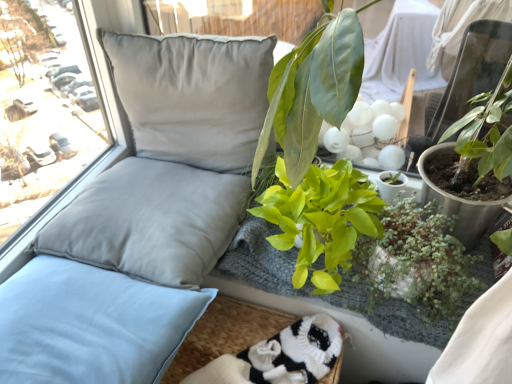
Question: Can you confirm if green leafy plant at center, the first floral arrangement in the bottom-to-top sequence, is smaller than green glossy plant at center, which ranks as the 1th houseplant in left-to-right order?

Choices:
 (A) yes
 (B) no

Answer: (A)

Question: From a real-world perspective, is green leafy plant at center, which ranks as the second floral arrangement in top-to-bottom order, located beneath green glossy plant at center, arranged as the second houseplant when viewed from the right?

Choices:
 (A) no
 (B) yes

Answer: (B)

Question: Is green leafy plant at center, the first floral arrangement in the bottom-to-top sequence, outside of green glossy plant at center, arranged as the second houseplant when viewed from the right?

Choices:
 (A) yes
 (B) no

Answer: (A)

Question: Considering the relative positions of green leafy plant at center, which ranks as the second floral arrangement in top-to-bottom order, and green glossy plant at center, which ranks as the 1th houseplant in left-to-right order, in the image provided, is green leafy plant at center, which ranks as the second floral arrangement in top-to-bottom order, behind green glossy plant at center, which ranks as the 1th houseplant in left-to-right order,?

Choices:
 (A) no
 (B) yes

Answer: (B)

Question: From the image's perspective, would you say green leafy plant at center, which ranks as the second floral arrangement in top-to-bottom order, is positioned over green glossy plant at center, arranged as the second houseplant when viewed from the right?

Choices:
 (A) no
 (B) yes

Answer: (A)

Question: Looking at their shapes, would you say green matte plant at lower right, the first houseplant positioned from the right, is wider or thinner than satin gray pillow at left, which appears as the second pillow when viewed from the top?

Choices:
 (A) wide
 (B) thin

Answer: (B)

Question: Is green matte plant at lower right, the 2th houseplant in the left-to-right sequence, spatially inside satin gray pillow at left, which ranks as the second pillow in bottom-to-top order, or outside of it?

Choices:
 (A) inside
 (B) outside

Answer: (B)

Question: Is green matte plant at lower right, the 2th houseplant in the left-to-right sequence, bigger or smaller than satin gray pillow at left, which ranks as the second pillow in bottom-to-top order?

Choices:
 (A) big
 (B) small

Answer: (B)

Question: From the image's perspective, is green matte plant at lower right, the 2th houseplant in the left-to-right sequence, above or below satin gray pillow at left, which appears as the second pillow when viewed from the top?

Choices:
 (A) above
 (B) below

Answer: (B)

Question: In terms of height, does green matte plant at lower right, the 2th houseplant in the left-to-right sequence, look taller or shorter compared to satin gray pillow at upper left, which is the third pillow in bottom-to-top order?

Choices:
 (A) short
 (B) tall

Answer: (A)

Question: From the image's perspective, is green matte plant at lower right, the first houseplant positioned from the right, located above or below satin gray pillow at upper left, acting as the 1th pillow starting from the top?

Choices:
 (A) below
 (B) above

Answer: (A)

Question: In terms of width, does green matte plant at lower right, the first houseplant positioned from the right, look wider or thinner when compared to satin gray pillow at upper left, acting as the 1th pillow starting from the top?

Choices:
 (A) thin
 (B) wide

Answer: (B)

Question: Considering the relative positions of green matte plant at lower right, the first houseplant positioned from the right, and satin gray pillow at upper left, which is the third pillow in bottom-to-top order, in the image provided, is green matte plant at lower right, the first houseplant positioned from the right, to the left or to the right of satin gray pillow at upper left, which is the third pillow in bottom-to-top order,?

Choices:
 (A) right
 (B) left

Answer: (A)

Question: Is point (131, 89) closer or farther from the camera than point (293, 102)?

Choices:
 (A) closer
 (B) farther

Answer: (B)

Question: Would you say satin gray pillow at upper left, which is the third pillow in bottom-to-top order, is inside or outside green leafy plant at upper right, acting as the 1th floral arrangement starting from the top?

Choices:
 (A) outside
 (B) inside

Answer: (A)